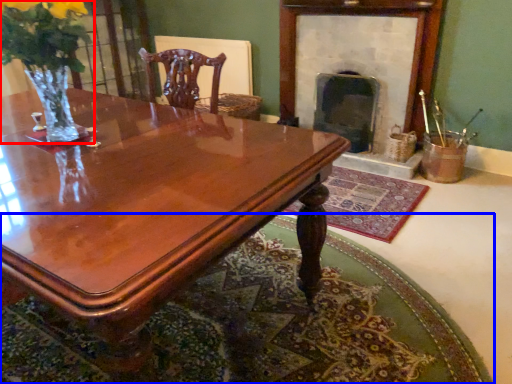
Question: Which of the following is the farthest to the observer, floral arrangement (highlighted by a red box) or mat (highlighted by a blue box)?

Choices:
 (A) floral arrangement
 (B) mat

Answer: (A)